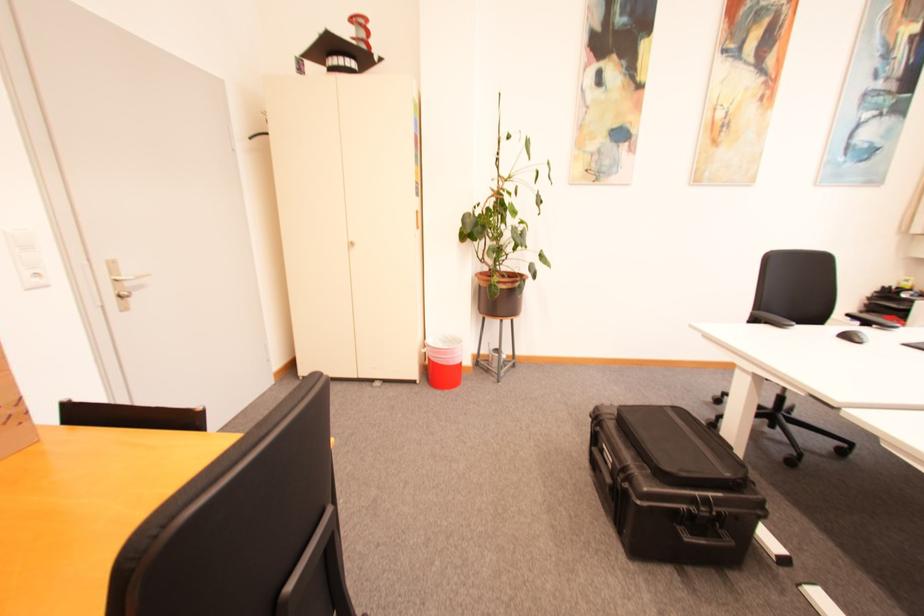
Image resolution: width=924 pixels, height=616 pixels. What do you see at coordinates (728, 541) in the screenshot?
I see `the black case handle` at bounding box center [728, 541].